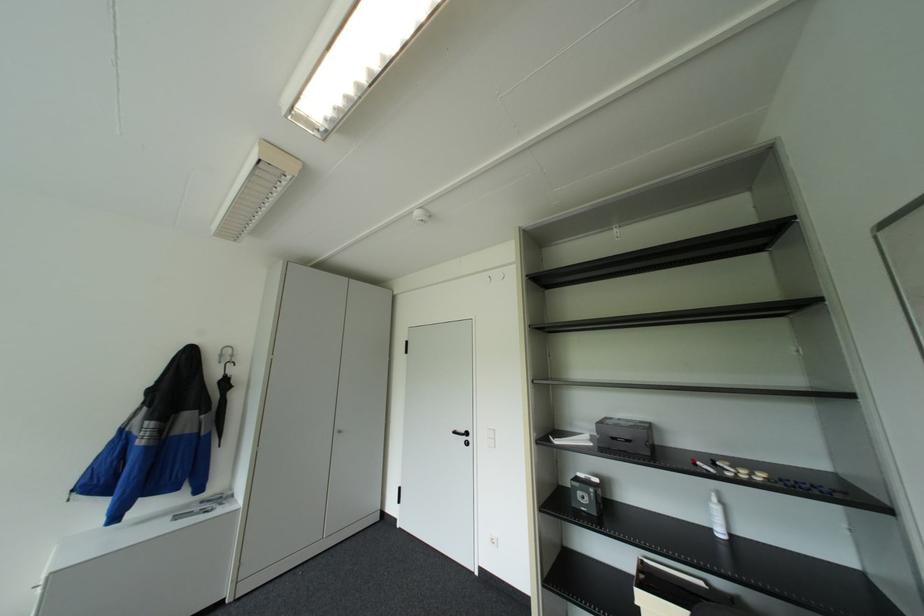
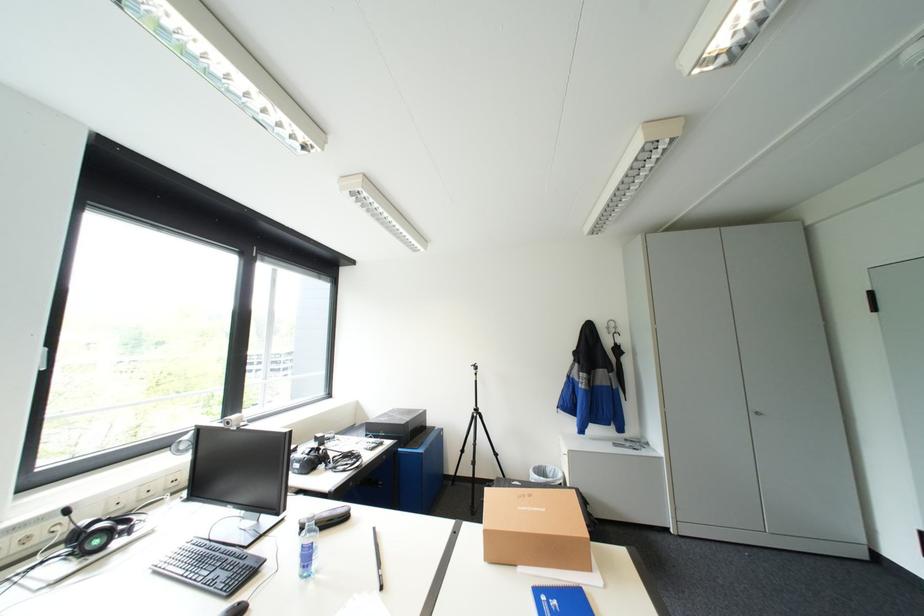
Question: The camera is either moving clockwise (left) or counter-clockwise (right) around the object. The first image is from the beginning of the video and the second image is from the end. Is the camera moving left or right when shooting the video?

Choices:
 (A) Left
 (B) Right

Answer: (B)